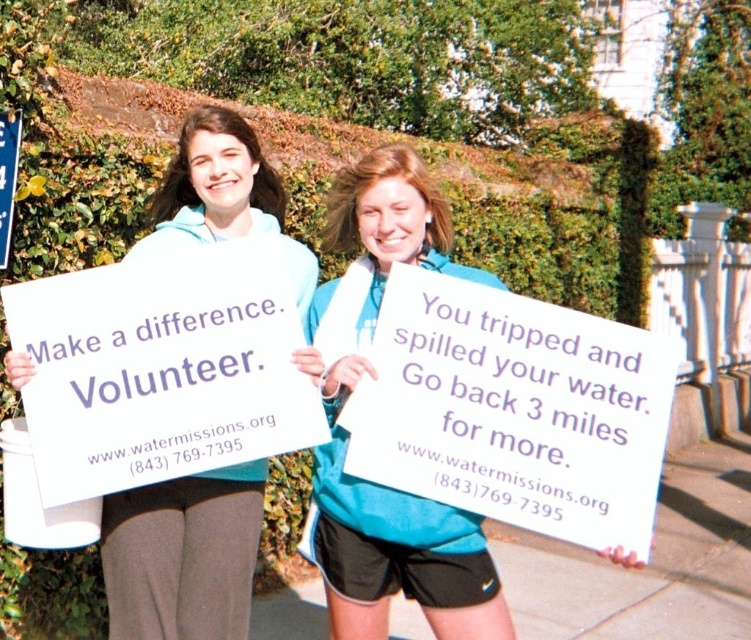
Question: From the image, what is the correct spatial relationship of white paper sign at center in relation to blue plastic sign at upper left?

Choices:
 (A) right
 (B) left

Answer: (A)

Question: Which is nearer to the matte blue sweatshirt at center?

Choices:
 (A) blue plastic sign at upper left
 (B) white paper sign at center

Answer: (B)

Question: Which of the following is the farthest from the observer?

Choices:
 (A) (436, 195)
 (B) (2, 259)
 (C) (249, 154)

Answer: (B)

Question: Can you confirm if white paper sign at center is thinner than blue plastic sign at upper left?

Choices:
 (A) yes
 (B) no

Answer: (B)

Question: Is white paper sign at center positioned before blue plastic sign at upper left?

Choices:
 (A) no
 (B) yes

Answer: (B)

Question: Among these points, which one is farthest from the camera?

Choices:
 (A) (115, 628)
 (B) (11, 173)
 (C) (427, 228)

Answer: (B)